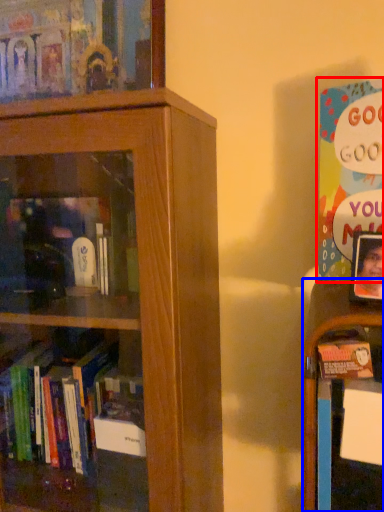
Question: Which object appears closest to the camera in this image, book (highlighted by a red box) or shelf (highlighted by a blue box)?

Choices:
 (A) book
 (B) shelf

Answer: (A)